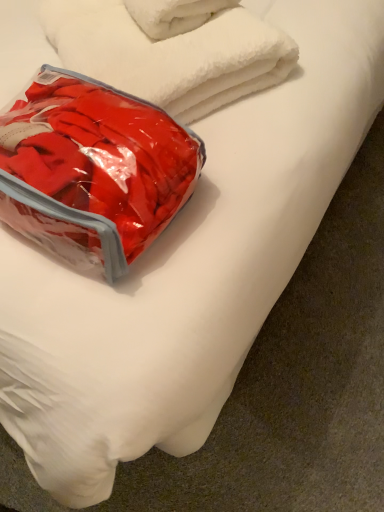
Question: Is point (160, 136) closer or farther from the camera than point (66, 13)?

Choices:
 (A) farther
 (B) closer

Answer: (B)

Question: Is transparent plastic bag at upper left inside the boundaries of white fluffy towel at upper center, or outside?

Choices:
 (A) outside
 (B) inside

Answer: (A)

Question: Would you say transparent plastic bag at upper left is to the left or to the right of white fluffy towel at upper center in the picture?

Choices:
 (A) left
 (B) right

Answer: (A)

Question: Looking at their shapes, would you say white fluffy towel at upper center is wider or thinner than transparent plastic bag at upper left?

Choices:
 (A) wide
 (B) thin

Answer: (A)

Question: Is white fluffy towel at upper center inside the boundaries of transparent plastic bag at upper left, or outside?

Choices:
 (A) outside
 (B) inside

Answer: (A)

Question: Is white fluffy towel at upper center in front of or behind transparent plastic bag at upper left in the image?

Choices:
 (A) front
 (B) behind

Answer: (B)

Question: Based on their positions, is white fluffy towel at upper center located to the left or right of transparent plastic bag at upper left?

Choices:
 (A) right
 (B) left

Answer: (A)